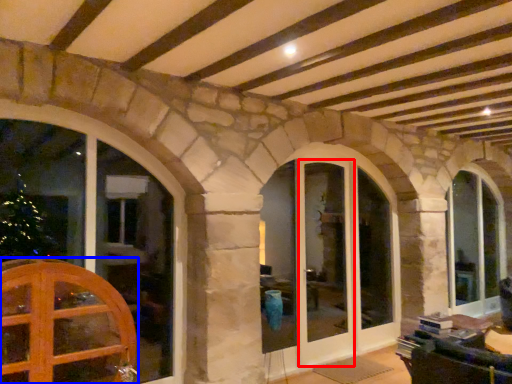
Question: Which object is closer to the camera taking this photo, screen door (highlighted by a red box) or door (highlighted by a blue box)?

Choices:
 (A) screen door
 (B) door

Answer: (B)